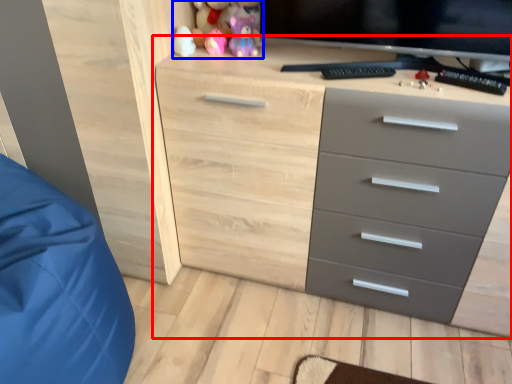
Question: Which point is further to the camera, chest of drawers (highlighted by a red box) or toy (highlighted by a blue box)?

Choices:
 (A) chest of drawers
 (B) toy

Answer: (B)